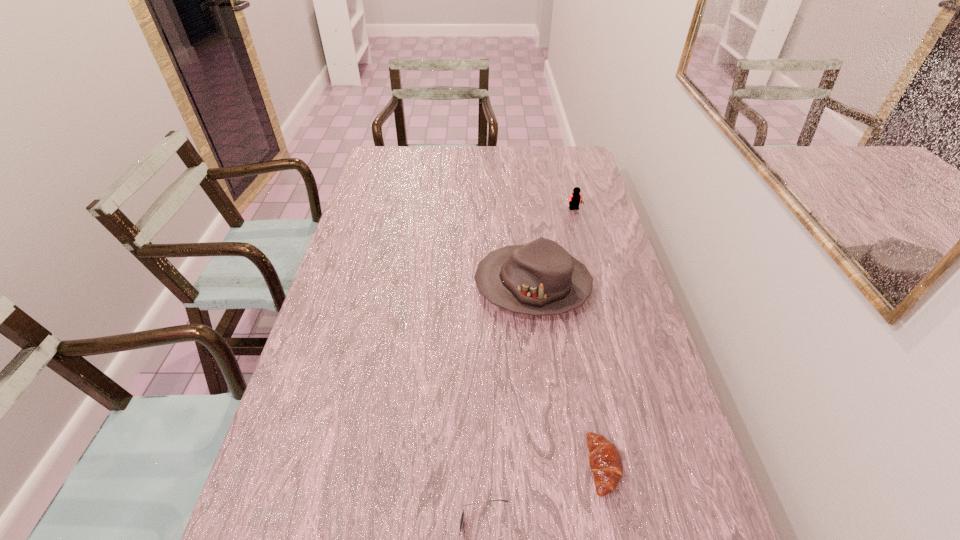
Image resolution: width=960 pixels, height=540 pixels. I want to click on vacant space that's between the third shortest object and the crescent roll, so click(589, 338).

Identify which object is located as the third nearest to the second nearest object. Please provide its 2D coordinates. Your answer should be formatted as a tuple, i.e. [(x, y)], where the tuple contains the x and y coordinates of a point satisfying the conditions above.

[(575, 198)]

Identify which object is located as the nearest to the farthest object. Please provide its 2D coordinates. Your answer should be formatted as a tuple, i.e. [(x, y)], where the tuple contains the x and y coordinates of a point satisfying the conditions above.

[(540, 278)]

Where is `vacant space that satisfies the following two spatial constraints: 1. on the decorative side of the hat; 2. on the back side of the second nearest object`? This screenshot has width=960, height=540. vacant space that satisfies the following two spatial constraints: 1. on the decorative side of the hat; 2. on the back side of the second nearest object is located at coordinates (555, 466).

Where is `free spot that satisfies the following two spatial constraints: 1. on the front-facing side of the Lego; 2. on the decorative side of the second farthest object`? Image resolution: width=960 pixels, height=540 pixels. free spot that satisfies the following two spatial constraints: 1. on the front-facing side of the Lego; 2. on the decorative side of the second farthest object is located at coordinates (594, 285).

In order to click on free space that satisfies the following two spatial constraints: 1. on the back side of the third tallest object; 2. on the decorative side of the second farthest object in this screenshot , I will do `click(567, 285)`.